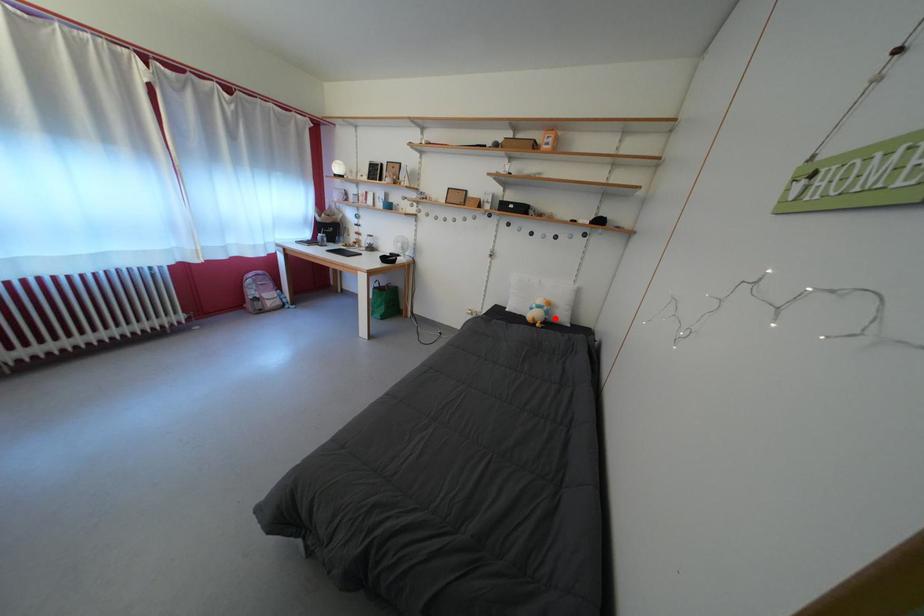
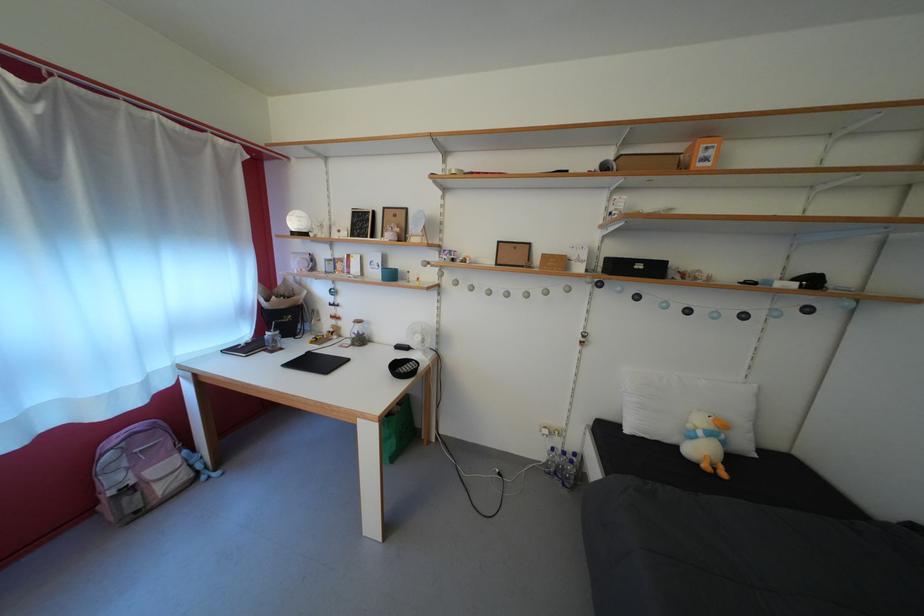
Where in the second image is the point corresponding to the highlighted location from the first image?

(732, 448)